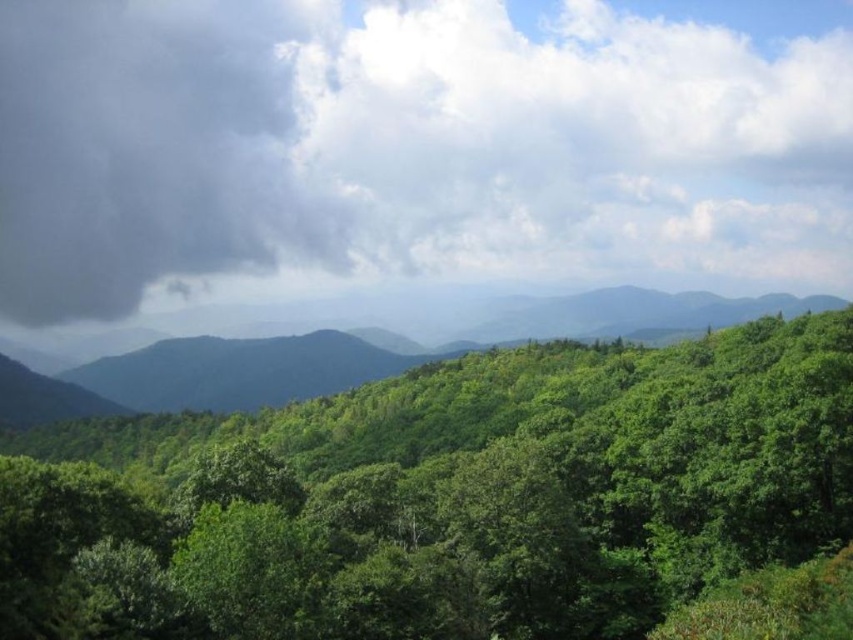
Between dark gray cloud at upper left and green leafy forest at center, which one appears on the right side from the viewer's perspective?

green leafy forest at center is more to the right.

I want to click on dark gray cloud at upper left, so click(x=415, y=147).

Find the location of a particular element. The width and height of the screenshot is (853, 640). dark gray cloud at upper left is located at coordinates (415, 147).

What are the coordinates of `dark gray cloud at upper left` in the screenshot? It's located at (415, 147).

Can you confirm if dark gray cloud at upper left is smaller than green leafy tree at center?

No.

Is point (323, 156) more distant than point (57, 442)?

Yes, point (323, 156) is behind point (57, 442).

Find the location of a particular element. The width and height of the screenshot is (853, 640). dark gray cloud at upper left is located at coordinates (415, 147).

Consider the image. Who is more forward, [143,636] or [254,376]?

Point [143,636] is more forward.

Which is behind, point (122, 570) or point (647, 300)?

The point (647, 300) is behind.

Where is `green leafy tree at center`? The height and width of the screenshot is (640, 853). green leafy tree at center is located at coordinates (442, 497).